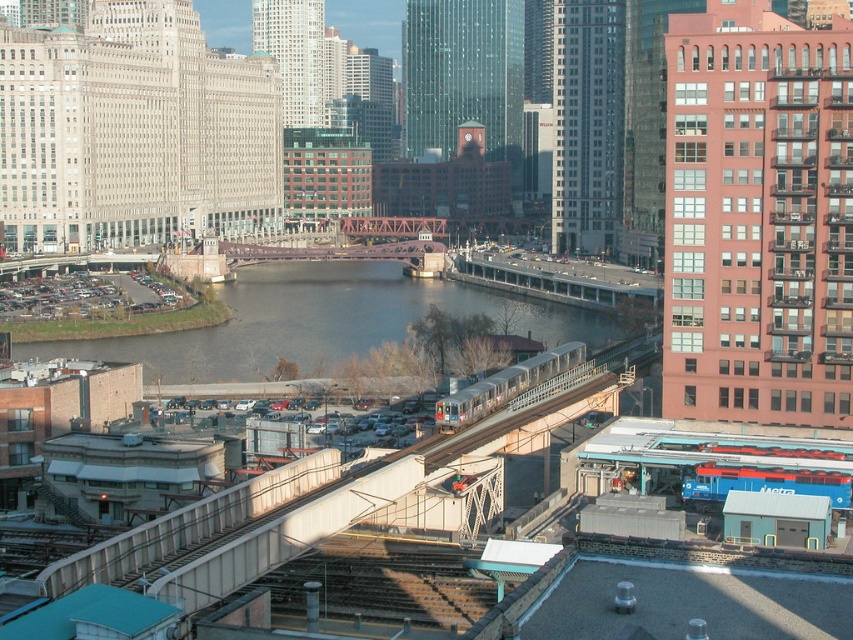
Does dark gray concrete waterway at center appear on the left side of silver metallic train at center?

Indeed, dark gray concrete waterway at center is positioned on the left side of silver metallic train at center.

Between point (256, 339) and point (537, 369), which one is positioned behind?

Point (256, 339)

Does point (376, 339) come behind point (508, 378)?

Yes.

Locate an element on the screen. dark gray concrete waterway at center is located at coordinates (322, 323).